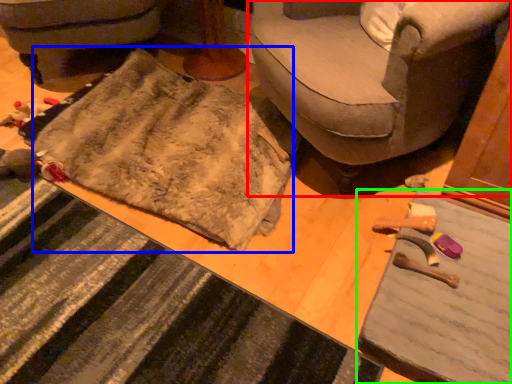
Question: Which object is positioned closest to studio couch (highlighted by a red box)? Select from blanket (highlighted by a blue box) and table (highlighted by a green box).

Choices:
 (A) blanket
 (B) table

Answer: (A)